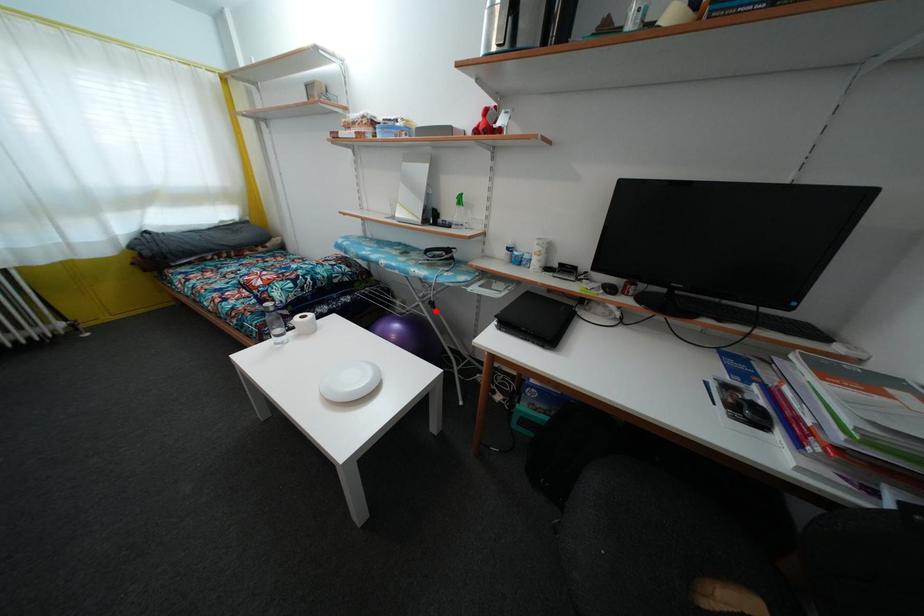
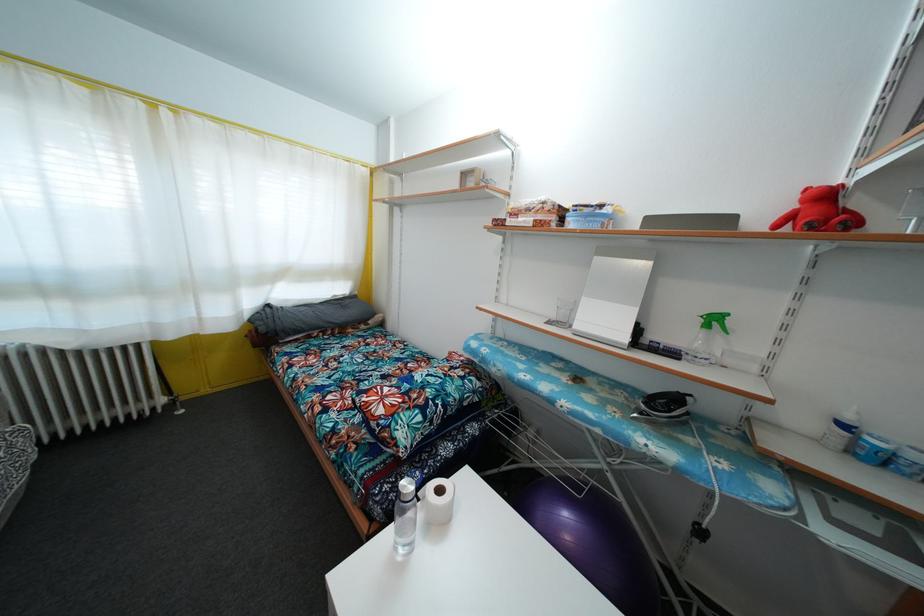
Question: I am providing you with two images of the same scene from different viewpoints. In image1, a red point is highlighted. Considering the same 3D point in image2, which of the following is correct?

Choices:
 (A) It is closer
 (B) It is farther

Answer: (B)